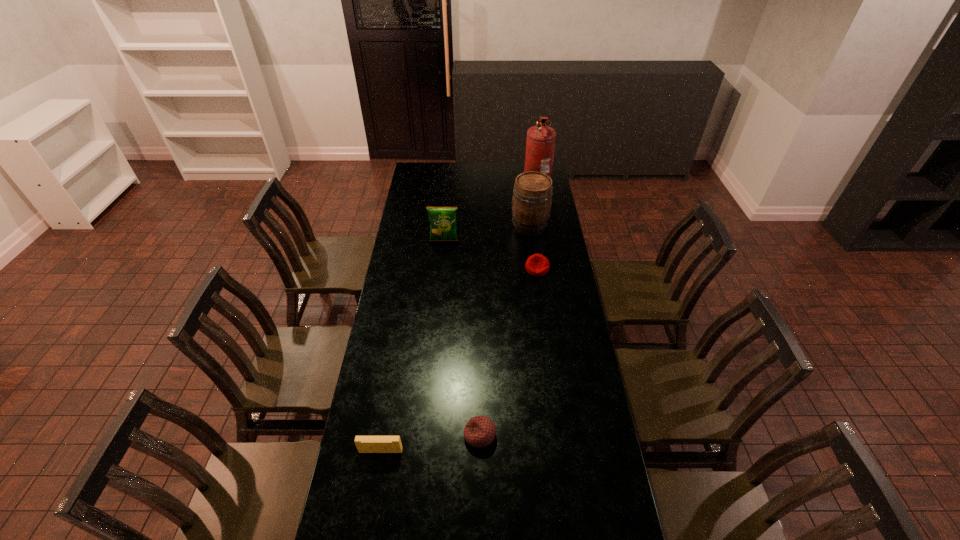
The height and width of the screenshot is (540, 960). In order to click on the left beanbag in this screenshot , I will do (x=479, y=431).

The height and width of the screenshot is (540, 960). Identify the location of free region located at the front of the farthest object where the nozzle is aimed. (460, 185).

What are the coordinates of `vacant area situated at the front of the farthest object where the nozzle is aimed` in the screenshot? It's located at (460, 185).

At what (x,y) coordinates should I click in order to perform the action: click on vacant space located 0.050m at the front of the farthest object where the nozzle is aimed. Please return your answer as a coordinate pair (x, y). Image resolution: width=960 pixels, height=540 pixels. Looking at the image, I should click on (514, 185).

Where is `free space located 0.070m on the side of the second tallest object near the bung hole`? This screenshot has width=960, height=540. free space located 0.070m on the side of the second tallest object near the bung hole is located at coordinates (497, 226).

Locate an element on the screen. This screenshot has width=960, height=540. vacant region located 0.260m on the side of the second tallest object near the bung hole is located at coordinates (461, 226).

The height and width of the screenshot is (540, 960). I want to click on vacant space situated 0.320m on the side of the second tallest object near the bung hole, so click(449, 226).

Find the location of a particular element. This screenshot has height=540, width=960. free location located on the front-facing side of the crisp (potato chip) is located at coordinates (443, 252).

Locate an element on the screen. vacant space situated 0.160m at the front of the leftmost object with spools is located at coordinates (372, 507).

At what (x,y) coordinates should I click in order to perform the action: click on vacant space located on the seat area of the fourth farthest object. Please return your answer as a coordinate pair (x, y). The image size is (960, 540). Looking at the image, I should click on (540, 292).